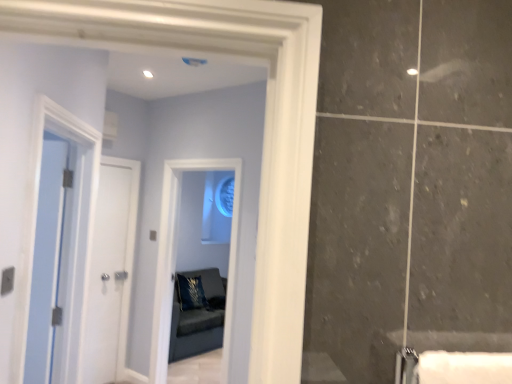
Describe the element at coordinates (47, 261) in the screenshot. This screenshot has width=512, height=384. I see `white glossy door at left, the 2th door in the back-to-front sequence` at that location.

What is the approximate width of blue glass window at center?

The width of blue glass window at center is 5.89 inches.

You are a GUI agent. You are given a task and a screenshot of the screen. Output one action in this format:
    pyautogui.click(x=<x>, y=<y>)
    Task: Click on the blue velvet pillow at center
    
    Given the screenshot: What is the action you would take?
    pyautogui.click(x=191, y=293)

Where is `white glossy door at left, which is counted as the 1th door, starting from the front`? white glossy door at left, which is counted as the 1th door, starting from the front is located at coordinates (47, 261).

From a real-world perspective, who is located higher, blue velvet pillow at center or clear glass mirror at center?

clear glass mirror at center is physically above.

Can you see blue velvet pillow at center touching clear glass mirror at center?

No, blue velvet pillow at center is not beside clear glass mirror at center.

Can clear glass mirror at center be found inside blue velvet pillow at center?

No, clear glass mirror at center is not inside blue velvet pillow at center.

In the image, is blue velvet pillow at center on the left side or the right side of white glossy door at left, the 2th door in the front-to-back sequence?

blue velvet pillow at center is to the right of white glossy door at left, the 2th door in the front-to-back sequence.

Based on the photo, which point is more forward, (192, 305) or (110, 281)?

The point (110, 281) is closer to the camera.

From the image's perspective, who appears lower, blue velvet pillow at center or white glossy door at left, the 2th door in the front-to-back sequence?

blue velvet pillow at center.

Find the location of a particular element. The width and height of the screenshot is (512, 384). door that is the 1st object located above the blue velvet pillow at center (from the image's perspective) is located at coordinates (108, 269).

Is white glossy door at left, which is counted as the first door, starting from the back, closer to camera compared to clear glass mirror at center?

Yes.

Can you confirm if white glossy door at left, the 2th door in the front-to-back sequence, is smaller than clear glass mirror at center?

Indeed, white glossy door at left, the 2th door in the front-to-back sequence, has a smaller size compared to clear glass mirror at center.

Is white glossy door at left, which is counted as the first door, starting from the back, positioned beyond the bounds of clear glass mirror at center?

That's correct, white glossy door at left, which is counted as the first door, starting from the back, is outside of clear glass mirror at center.

Which object is positioned more to the right, white glossy door at left, the 2th door in the front-to-back sequence, or clear glass mirror at center?

clear glass mirror at center is more to the right.

How many degrees apart are the facing directions of white glossy door at left, the 2th door in the front-to-back sequence, and white glossy door at left, the 2th door in the back-to-front sequence?

51.9 degrees.

Which object is thinner, white glossy door at left, which is counted as the first door, starting from the back, or white glossy door at left, the 2th door in the back-to-front sequence?

Thinner between the two is white glossy door at left, which is counted as the first door, starting from the back.

In terms of height, does white glossy door at left, which is counted as the first door, starting from the back, look taller or shorter compared to white glossy door at left, which is counted as the 1th door, starting from the front?

Clearly, white glossy door at left, which is counted as the first door, starting from the back, is taller compared to white glossy door at left, which is counted as the 1th door, starting from the front.

Considering the points (102, 194) and (45, 375), which point is in front, point (102, 194) or point (45, 375)?

Point (45, 375)

Is white glossy door at left, the 2th door in the front-to-back sequence, turned away from blue velvet pillow at center?

No, white glossy door at left, the 2th door in the front-to-back sequence, is not facing away from blue velvet pillow at center.

Does white glossy door at left, which is counted as the first door, starting from the back, have a larger size compared to blue velvet pillow at center?

Actually, white glossy door at left, which is counted as the first door, starting from the back, might be smaller than blue velvet pillow at center.

Is white glossy door at left, which is counted as the first door, starting from the back, located outside blue velvet pillow at center?

Yes, white glossy door at left, which is counted as the first door, starting from the back, is not within blue velvet pillow at center.

Between white glossy door at left, which is counted as the first door, starting from the back, and blue velvet pillow at center, which one has smaller width?

white glossy door at left, which is counted as the first door, starting from the back.

Between blue glass window at center and clear glass mirror at center, which one has less height?

With less height is clear glass mirror at center.

From a real-world perspective, is blue glass window at center physically below clear glass mirror at center?

Yes, from a real-world perspective, blue glass window at center is under clear glass mirror at center.

In the scene shown: Is blue glass window at center to the right of clear glass mirror at center from the viewer's perspective?

No.

From the image's perspective, relative to clear glass mirror at center, is blue glass window at center above or below?

Clearly, from the image's perspective, blue glass window at center is below clear glass mirror at center.

Looking at this image, choose the correct answer: Is white glossy door at left, which is counted as the 1th door, starting from the front, inside blue glass window at center or outside it?

The correct answer is: outside.

Considering the relative sizes of white glossy door at left, the 2th door in the back-to-front sequence, and blue glass window at center in the image provided, is white glossy door at left, the 2th door in the back-to-front sequence, thinner than blue glass window at center?

Yes.

Could you tell me if white glossy door at left, the 2th door in the back-to-front sequence, is facing blue glass window at center?

No, white glossy door at left, the 2th door in the back-to-front sequence, is not oriented towards blue glass window at center.

From a real-world perspective, is white glossy door at left, the 2th door in the back-to-front sequence, physically located above or below blue glass window at center?

From a real-world perspective, white glossy door at left, the 2th door in the back-to-front sequence, is physically above blue glass window at center.

This screenshot has height=384, width=512. Find the location of `mirror above the blue velvet pillow at center (from the image's perspective)`. mirror above the blue velvet pillow at center (from the image's perspective) is located at coordinates (225, 196).

At what (x,y) coordinates should I click in order to perform the action: click on the 1st door in front when counting from the blue velvet pillow at center. Please return your answer as a coordinate pair (x, y). Looking at the image, I should click on (108, 269).

Which object lies further to the anchor point blue velvet pillow at center, white glossy door at left, the 2th door in the front-to-back sequence, or blue glass window at center?

white glossy door at left, the 2th door in the front-to-back sequence, is further to blue velvet pillow at center.

Based on their spatial positions, is white glossy door at left, the 2th door in the front-to-back sequence, or white glossy door at left, which is counted as the 1th door, starting from the front, closer to blue glass window at center?

white glossy door at left, the 2th door in the front-to-back sequence, is positioned closer to the anchor blue glass window at center.

Based on their spatial positions, is clear glass mirror at center or white glossy door at left, the 2th door in the front-to-back sequence, further from blue glass window at center?

The object further to blue glass window at center is clear glass mirror at center.

From the image, which object appears to be farther from white glossy door at left, the 2th door in the back-to-front sequence, white glossy door at left, the 2th door in the front-to-back sequence, or clear glass mirror at center?

Based on the image, clear glass mirror at center appears to be further to white glossy door at left, the 2th door in the back-to-front sequence.

Estimate the real-world distances between objects in this image. Which object is closer to clear glass mirror at center, blue glass window at center or white glossy door at left, the 2th door in the back-to-front sequence?

blue glass window at center is positioned closer to the anchor clear glass mirror at center.

From the picture: Considering their positions, is blue glass window at center positioned closer to clear glass mirror at center than blue velvet pillow at center?

Result: Based on the image, blue velvet pillow at center appears to be nearer to clear glass mirror at center.

When comparing their distances from blue glass window at center, does clear glass mirror at center or white glossy door at left, which is counted as the 1th door, starting from the front, seem closer?

The object closer to blue glass window at center is white glossy door at left, which is counted as the 1th door, starting from the front.

Estimate the real-world distances between objects in this image. Which object is closer to blue glass window at center, white glossy door at left, the 2th door in the back-to-front sequence, or white glossy door at left, which is counted as the first door, starting from the back?

The object closer to blue glass window at center is white glossy door at left, which is counted as the first door, starting from the back.

This screenshot has height=384, width=512. What are the coordinates of `window between white glossy door at left, which is counted as the 1th door, starting from the front, and white glossy door at left, the 2th door in the front-to-back sequence, in the front-back direction` in the screenshot? It's located at (175, 258).

In order to click on window between white glossy door at left, which is counted as the 1th door, starting from the front, and blue velvet pillow at center from front to back in this screenshot , I will do `click(175, 258)`.

Where is `door between blue glass window at center and clear glass mirror at center along the z-axis`? door between blue glass window at center and clear glass mirror at center along the z-axis is located at coordinates (108, 269).

I want to click on pillow between white glossy door at left, the 2th door in the front-to-back sequence, and clear glass mirror at center in the front-back direction, so click(191, 293).